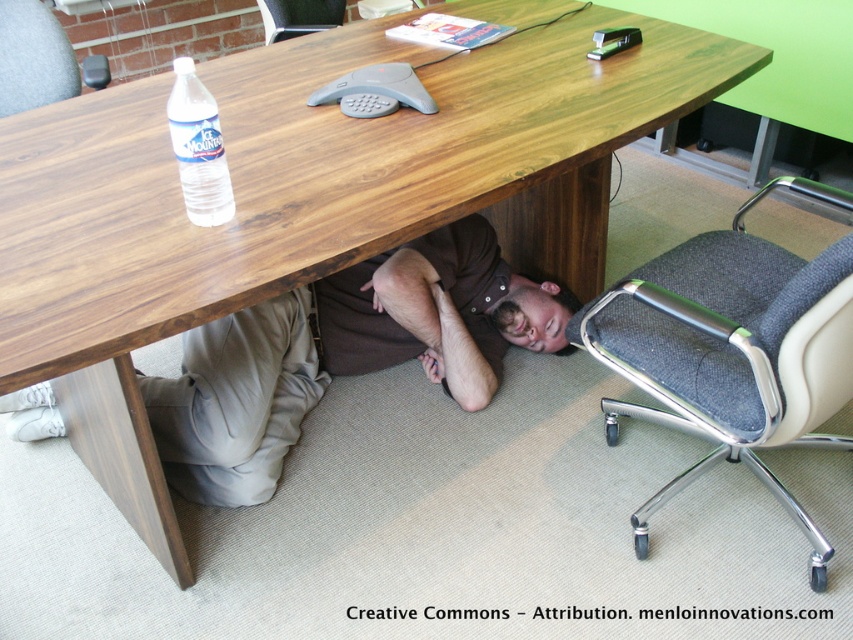
You are a cleaning robot with a width of 24 inches. You need to move from the brown cotton shirt at under table to the gray fabric swivel chair at lower right. Can you fit through the space between them?

The distance between the brown cotton shirt at under table and the gray fabric swivel chair at lower right is 23.92 inches. Since the robot is 24 inches wide, it cannot fit through the space between them as the available space is slightly narrower than the robot.

You are standing at the point marked as point (804, 180) in the office. You want to take a photo of the entire conference table. Will you be able to capture the entire table in your camera frame without moving? Explain your reasoning.

The point (804, 180) is 1.72 meters away from the camera. Since the camera can capture the entire conference table from that distance, you can take the photo without moving.

You are organizing a meeting in the office and need to check if there is enough space under the table for two people to sit comfortably. The gray fabric swivel chair at lower right is already placed there. Is the brown cotton shirt at under table positioned in a way that might block access to the chair?

The brown cotton shirt at under table is to the left of the gray fabric swivel chair at lower right, so it might block access to the chair if someone tries to sit there.